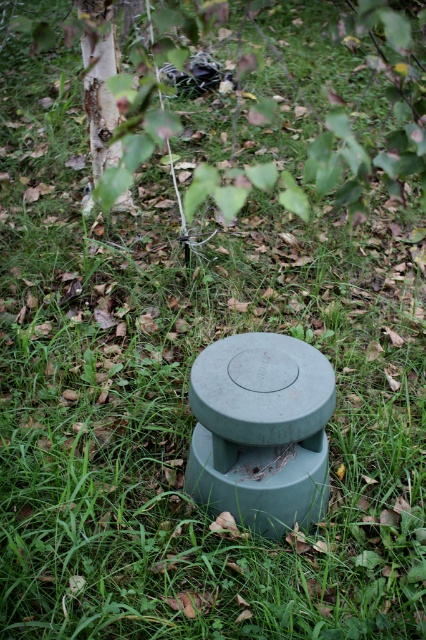
You are standing in the grassy area and want to place a small flag at the exact center of the green matte cement located at point [261,429]. Can you confirm if the flag will be placed on the cement?

Yes, the flag will be placed on the green matte cement at center since the point [261,429] is exactly where the green matte cement is located.